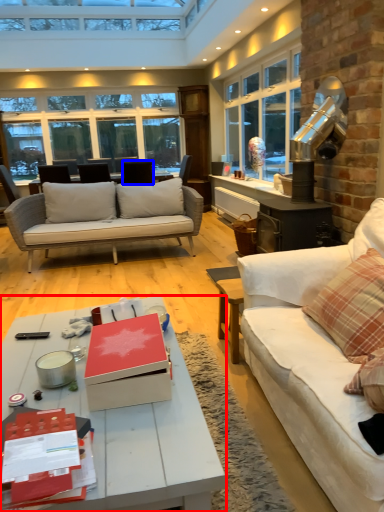
Question: Which object appears farthest to the camera in this image, coffee table (highlighted by a red box) or chair (highlighted by a blue box)?

Choices:
 (A) coffee table
 (B) chair

Answer: (B)